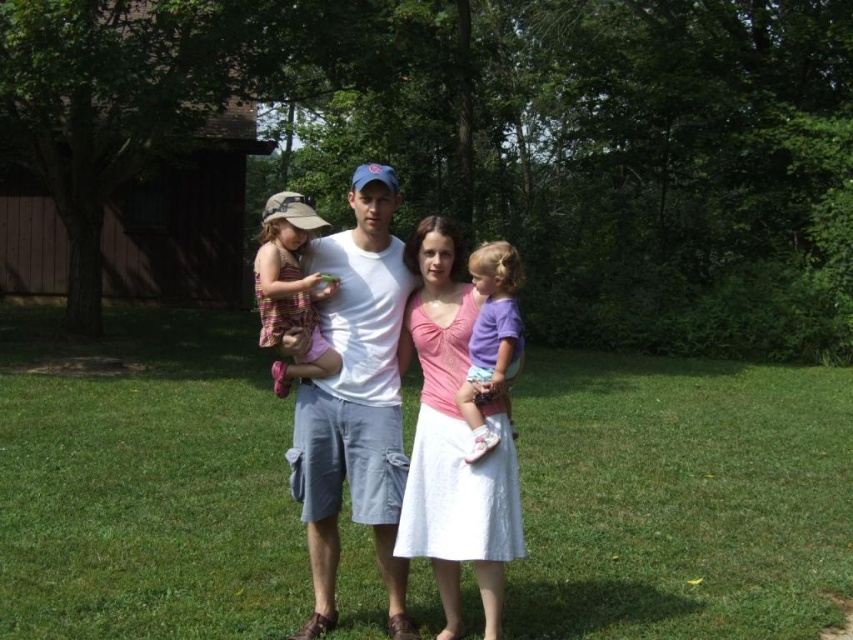
Measure the distance between pink lace dress at center and camera.

pink lace dress at center and camera are 3.71 meters apart from each other.

Can you confirm if pink lace dress at center is smaller than purple cotton shirt at center?

Incorrect, pink lace dress at center is not smaller in size than purple cotton shirt at center.

Is point (486, 564) positioned before point (495, 284)?

Yes, point (486, 564) is in front of point (495, 284).

Where is `pink lace dress at center`? pink lace dress at center is located at coordinates (453, 440).

In the scene shown: Is white cotton t-shirt at center below pink lace dress at center?

No.

Which of these two, white cotton t-shirt at center or pink lace dress at center, stands taller?

With more height is white cotton t-shirt at center.

The image size is (853, 640). I want to click on white cotton t-shirt at center, so click(x=355, y=401).

Does green grass at center appear on the right side of striped fabric dress at left?

No, green grass at center is not to the right of striped fabric dress at left.

The height and width of the screenshot is (640, 853). In order to click on green grass at center in this screenshot , I will do `click(144, 481)`.